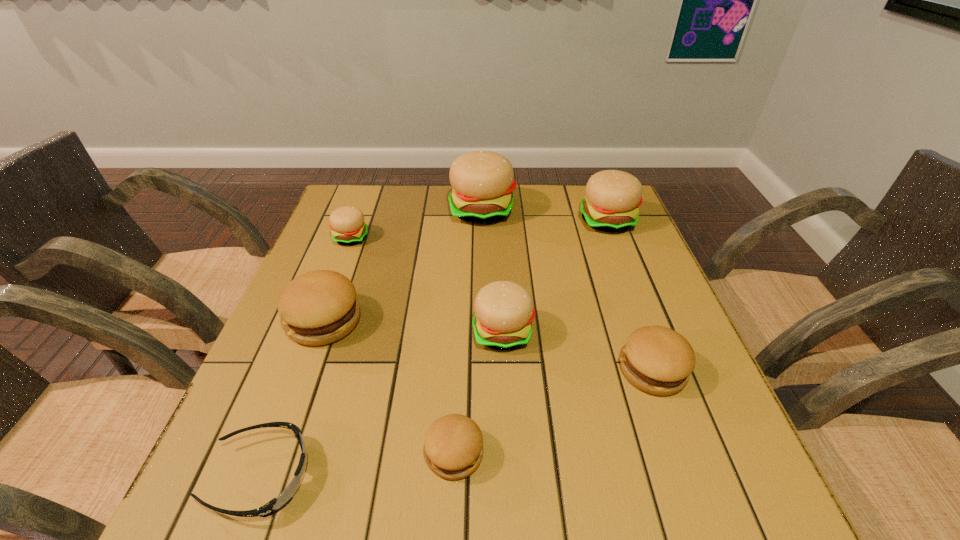
Identify the location of sunglasses. (276, 504).

At what (x,y) coordinates should I click in order to perform the action: click on vacant space located 0.190m on the left of the biggest beige hamburger. Please return your answer as a coordinate pair (x, y). Image resolution: width=960 pixels, height=540 pixels. Looking at the image, I should click on (386, 211).

Find the location of a particular element. Image resolution: width=960 pixels, height=540 pixels. free location located on the left of the third smallest beige hamburger is located at coordinates (451, 221).

Where is `vacant space situated 0.300m on the left of the nearest beige hamburger`? The width and height of the screenshot is (960, 540). vacant space situated 0.300m on the left of the nearest beige hamburger is located at coordinates (334, 332).

Identify the location of blank space located on the back of the leftmost brown hamburger. (361, 220).

At what (x,y) coordinates should I click in order to perform the action: click on free spot located 0.070m on the front of the rightmost brown hamburger. Please return your answer as a coordinate pair (x, y). Looking at the image, I should click on (675, 433).

This screenshot has width=960, height=540. In order to click on vacant space located 0.050m on the back of the smallest beige hamburger in this screenshot , I will do `click(358, 218)`.

You are a GUI agent. You are given a task and a screenshot of the screen. Output one action in this format:
    pyautogui.click(x=<x>, y=<y>)
    Task: Click on the blank space located 0.360m on the back of the nearest hamburger
    
    Given the screenshot: What is the action you would take?
    pyautogui.click(x=462, y=291)

Where is `free spot located on the lenses of the sunglasses`? free spot located on the lenses of the sunglasses is located at coordinates (390, 476).

Locate an element on the screen. Image resolution: width=960 pixels, height=540 pixels. hamburger that is at the near edge is located at coordinates (453, 444).